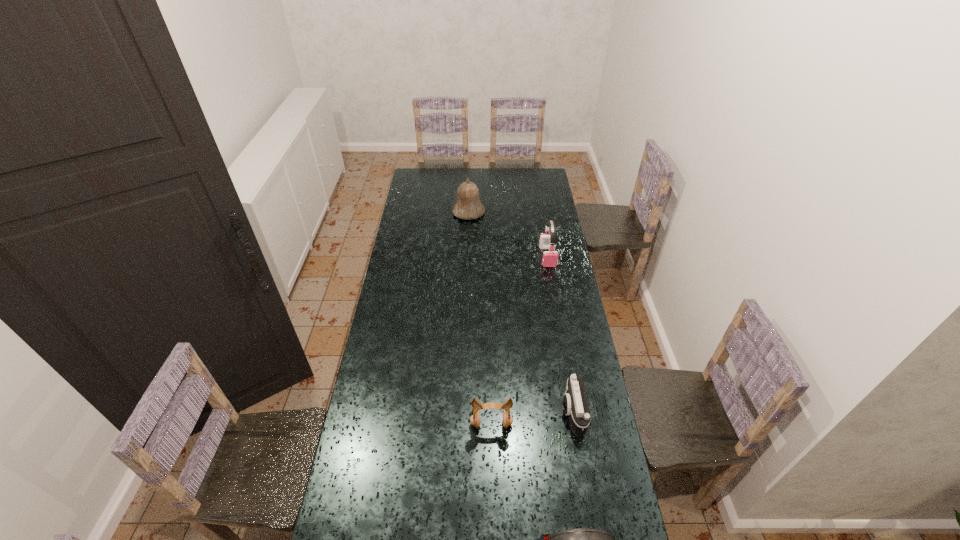
Locate an element on the screen. This screenshot has height=540, width=960. vacant space that satisfies the following two spatial constraints: 1. on the outer surface of the second farthest object; 2. on the front lens of the camera is located at coordinates (574, 412).